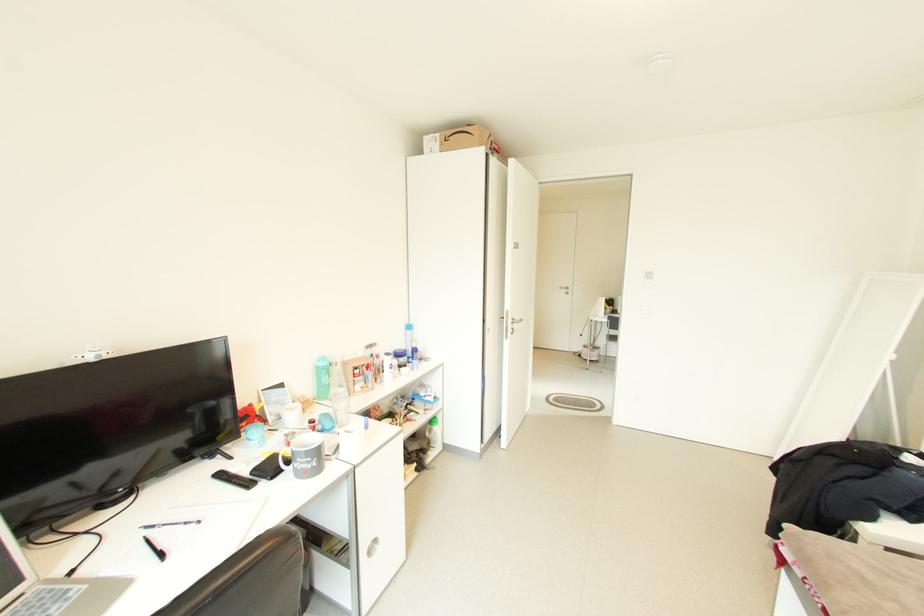
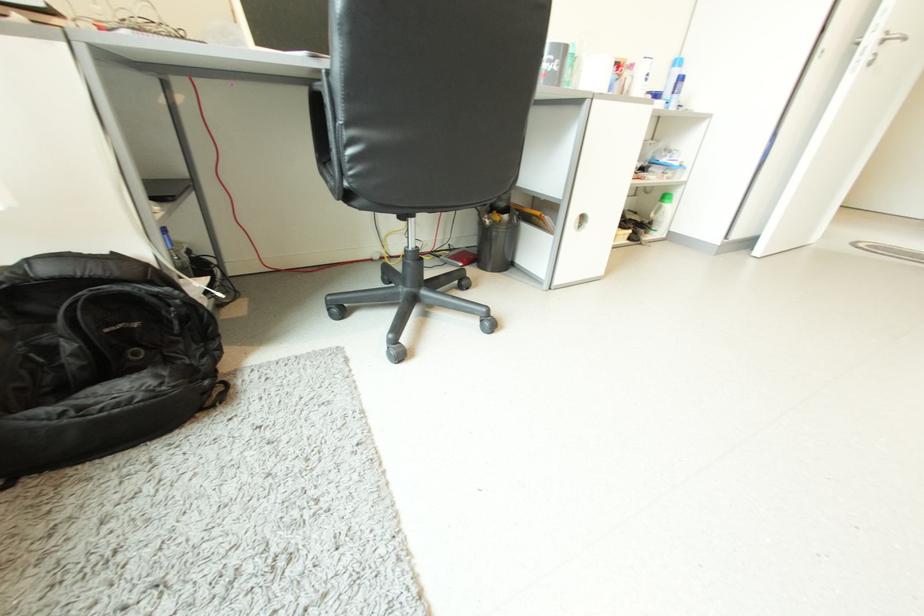
Find the pixel in the second image that matches (x=436, y=448) in the first image.

(657, 232)